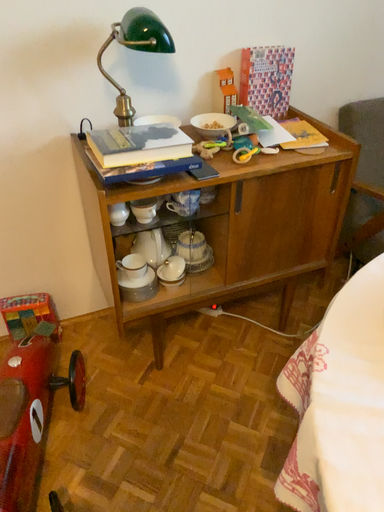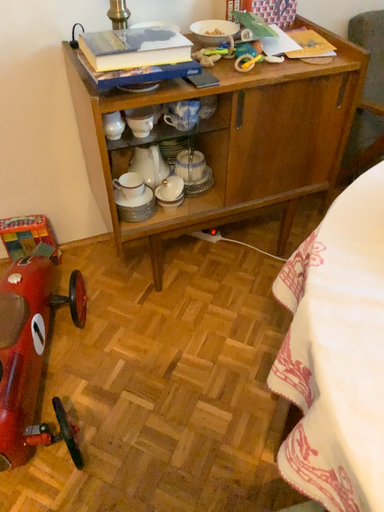
Question: Which way did the camera rotate in the video?

Choices:
 (A) rotated downward
 (B) rotated upward

Answer: (A)